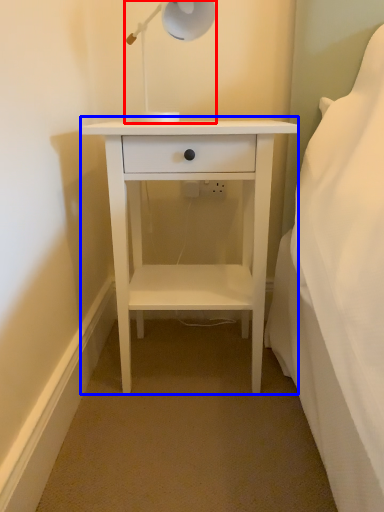
Question: Which object appears farthest to the camera in this image, lamp (highlighted by a red box) or nightstand (highlighted by a blue box)?

Choices:
 (A) lamp
 (B) nightstand

Answer: (B)